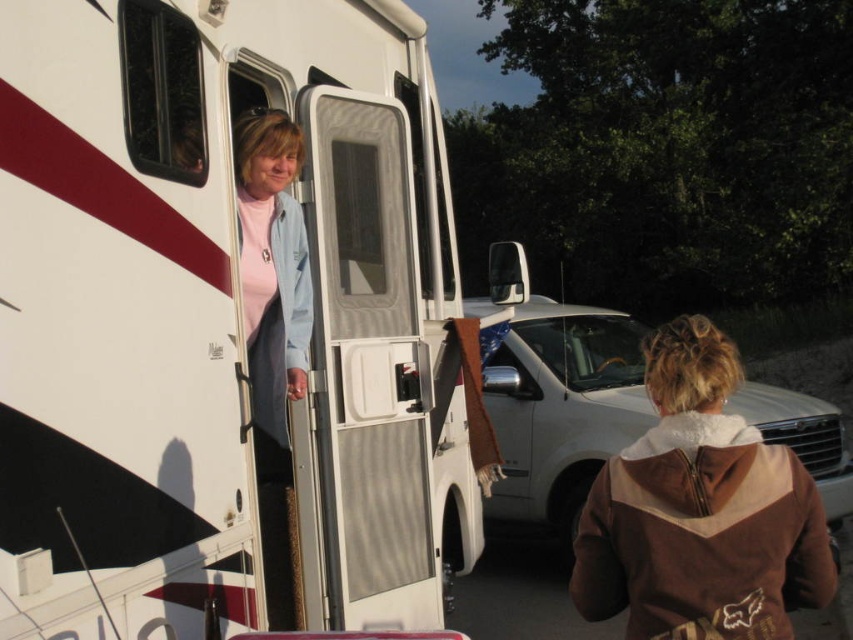
You are standing at the entrance of a campground and want to park your car between the white matte trailer truck at center and the brown fleece jacket at upper right. Given that your car is 4.5 feet wide, can you safely park there without touching either object?

The distance between the white matte trailer truck at center and the brown fleece jacket at upper right is 5.24 feet. Since your car is 4.5 feet wide, it can fit between them as long as you position it correctly, leaving enough space on both sides to avoid contact.

You are standing at the point marked as point (399, 445). The person inside the RV is wearing a light blue jacket over a pink top and has short blonde hair. The person outside is wearing a brown hoodie with a fox logo. How far apart are these two people?

The two people are 3.45 meters apart.

You are standing at the entrance of the parking lot and see the white matte trailer truck at center and the brown fleece jacket at upper right. Which object is closer to you?

The white matte trailer truck at center is closer to you because it is in front of the brown fleece jacket at upper right.